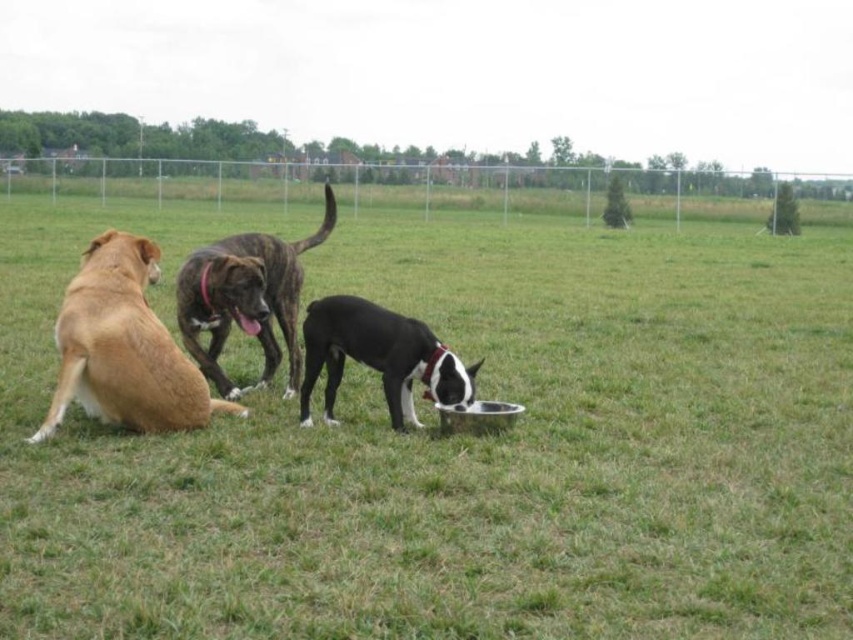
What are the coordinates of the brindle fur dog at center?

The brindle fur dog at center is located at coordinates point (245, 298).

You are a drone operator trying to capture a photo of the golden fur dog at left and the green grass at center. Your drone has a camera with a 10 feet focal length. Can you get both subjects in the same frame without moving the drone?

The green grass at center is 15.18 feet away from the golden fur dog at left. Since the drone camera has a 10 feet focal length, it cannot capture both subjects in the same frame as the distance between them exceeds the focal length.

Where is the golden fur dog at left located in the image?

The golden fur dog at left is located at point (123,348) in the image.